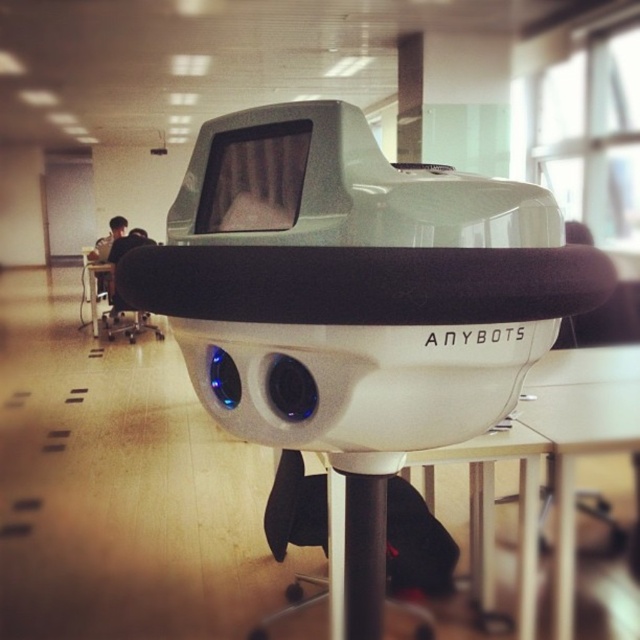
Is white matte anybots at center closer to the viewer compared to matte black chair at left?

Yes, white matte anybots at center is in front of matte black chair at left.

This screenshot has height=640, width=640. In order to click on white matte anybots at center in this screenshot , I will do `click(355, 305)`.

Identify the location of white matte anybots at center. The image size is (640, 640). (355, 305).

Image resolution: width=640 pixels, height=640 pixels. Identify the location of white matte anybots at center. (355, 305).